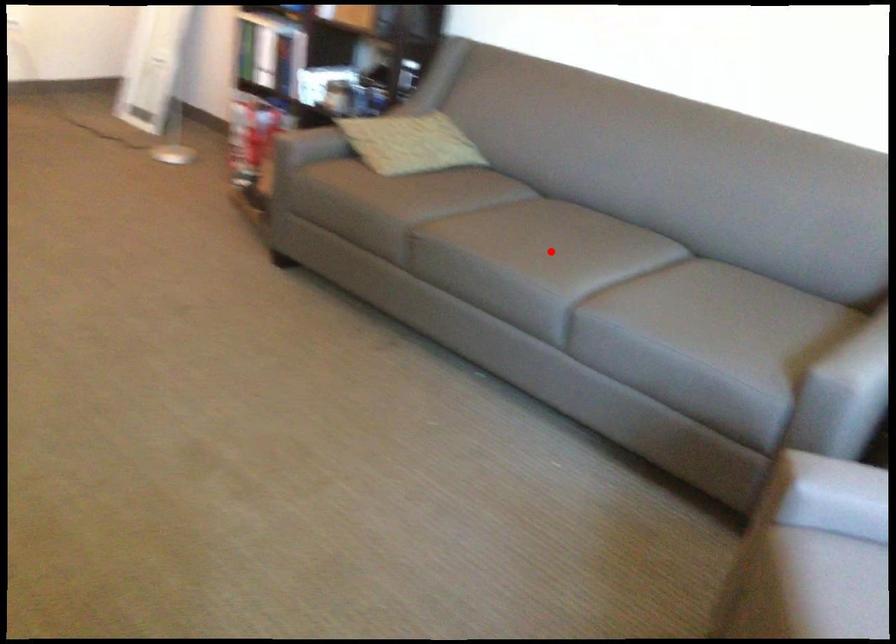
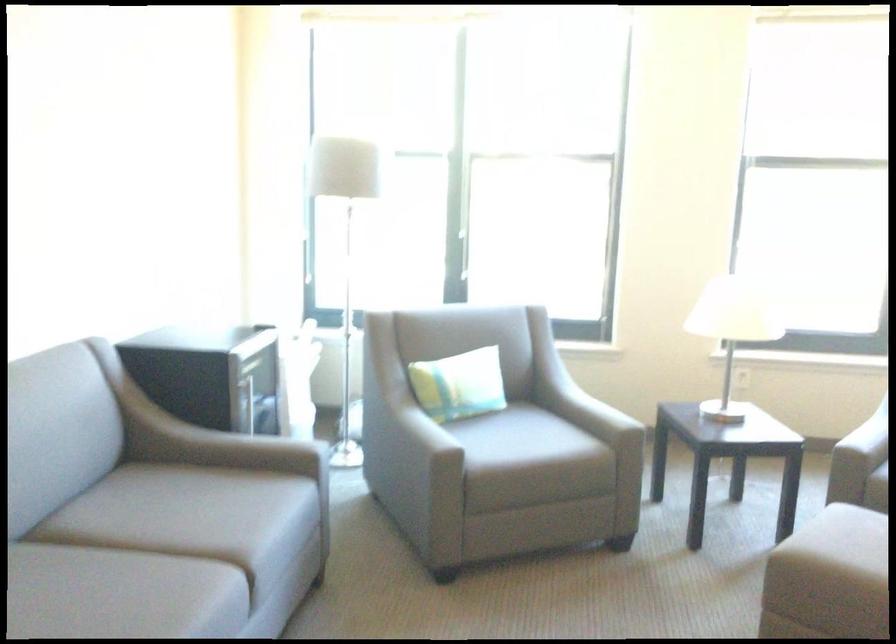
Question: I am providing you with two images of the same scene from different viewpoints. In image1, a red point is highlighted. Considering the same 3D point in image2, which of the following is correct?

Choices:
 (A) It is closer
 (B) It is farther

Answer: (A)